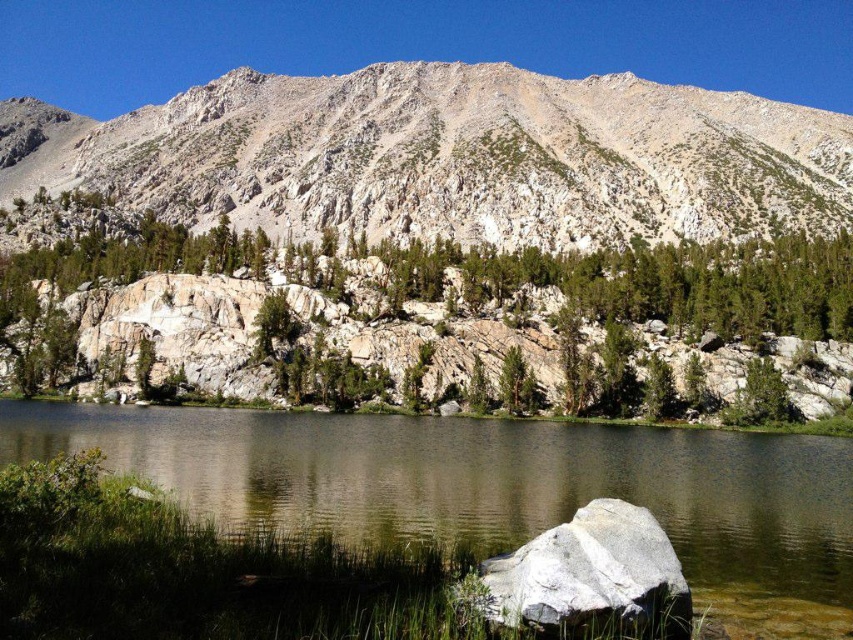
Is point (398, 467) positioned after point (131, 269)?

No.

Is clear water at center taller than green textured rock at upper center?

No, clear water at center is not taller than green textured rock at upper center.

Who is more forward, (178, 420) or (175, 227)?

Point (178, 420)

Image resolution: width=853 pixels, height=640 pixels. Find the location of `clear water at center`. clear water at center is located at coordinates (489, 483).

Describe the element at coordinates (451, 156) in the screenshot. I see `rugged stone mountain at upper center` at that location.

Where is `rugged stone mountain at upper center`? rugged stone mountain at upper center is located at coordinates (451, 156).

You are a GUI agent. You are given a task and a screenshot of the screen. Output one action in this format:
    pyautogui.click(x=<x>, y=<y>)
    Task: Click on the clear water at center
    
    Given the screenshot: What is the action you would take?
    pyautogui.click(x=489, y=483)

Is clear water at center above white granite boulder at lower center?

Yes, clear water at center is above white granite boulder at lower center.

Locate an element on the screen. clear water at center is located at coordinates (489, 483).